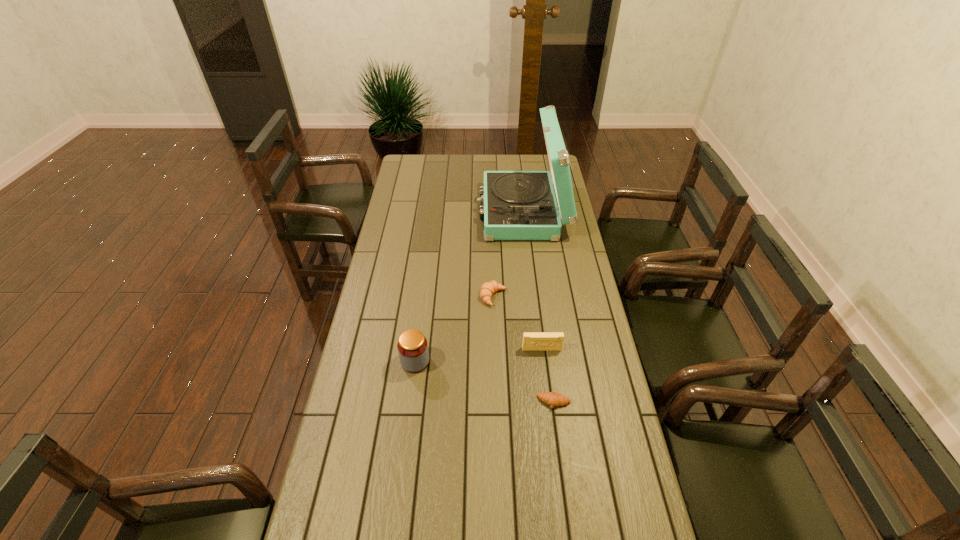
Identify the location of the tallest object. (517, 205).

Where is `the farthest object`? the farthest object is located at coordinates (517, 205).

Identify the location of jar. This screenshot has height=540, width=960. (412, 346).

I want to click on the fourth shortest object, so click(412, 346).

The width and height of the screenshot is (960, 540). I want to click on videotape, so click(532, 341).

Where is `the second farthest object`? The width and height of the screenshot is (960, 540). the second farthest object is located at coordinates (488, 289).

Identify the location of the left crescent roll. (488, 289).

Locate an element on the screen. This screenshot has width=960, height=540. the right crescent roll is located at coordinates (553, 399).

I want to click on the shorter crescent roll, so click(x=553, y=399).

The image size is (960, 540). I want to click on vacant space located on the face side of the tallest object, so click(x=442, y=212).